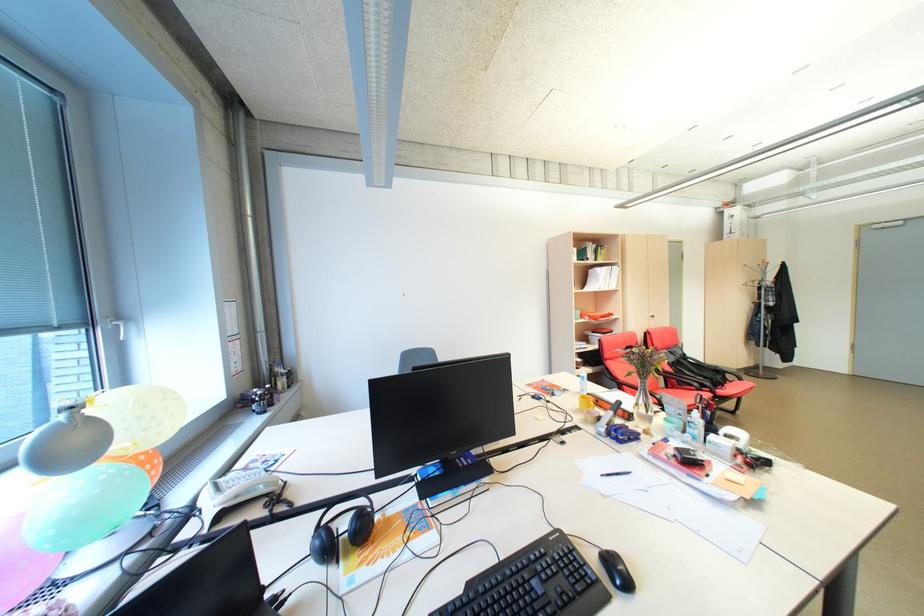
At what (x,y) coordinates should I click in order to perform the action: click on white telephone handset. Please return your answer as a coordinate pair (x, y). Looking at the image, I should click on (250, 488).